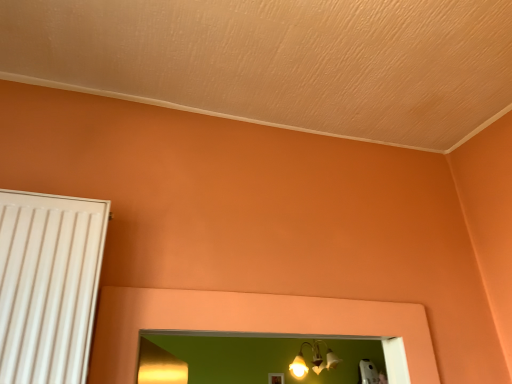
Image resolution: width=512 pixels, height=384 pixels. Describe the element at coordinates (48, 285) in the screenshot. I see `white ribbed radiator at left` at that location.

This screenshot has height=384, width=512. I want to click on white ribbed radiator at left, so click(x=48, y=285).

Measure the distance between point (70,302) and camera.

1.01 meters.

This screenshot has height=384, width=512. In order to click on white ribbed radiator at left in this screenshot , I will do `click(48, 285)`.